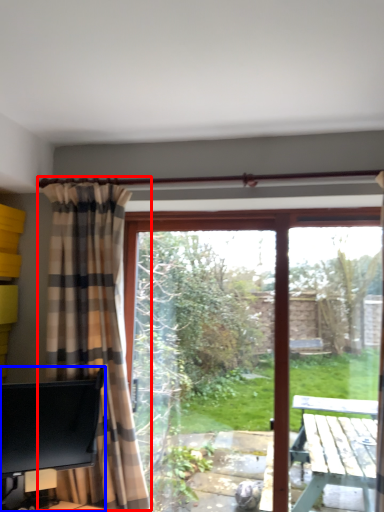
Question: Which object is further to the camera taking this photo, curtain (highlighted by a red box) or desk (highlighted by a blue box)?

Choices:
 (A) curtain
 (B) desk

Answer: (A)